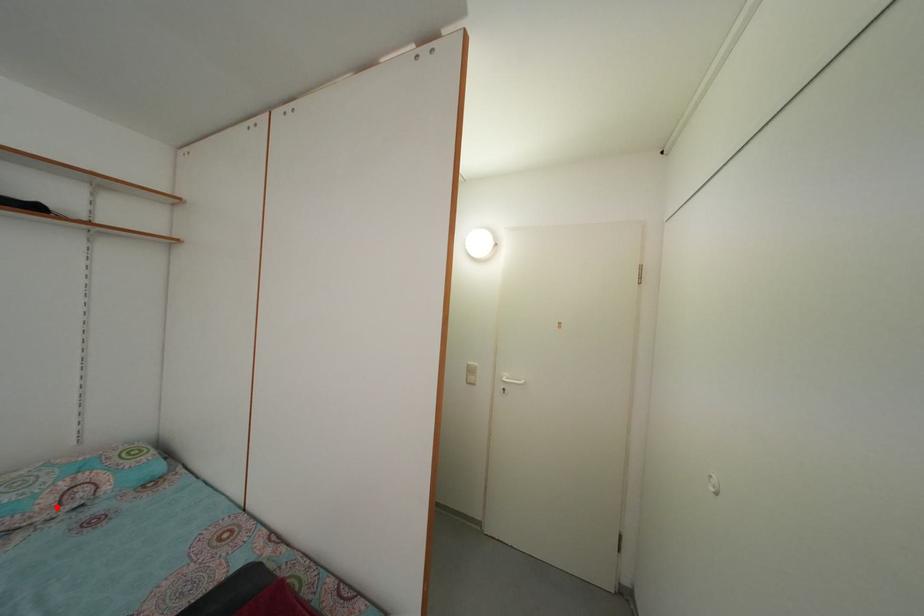
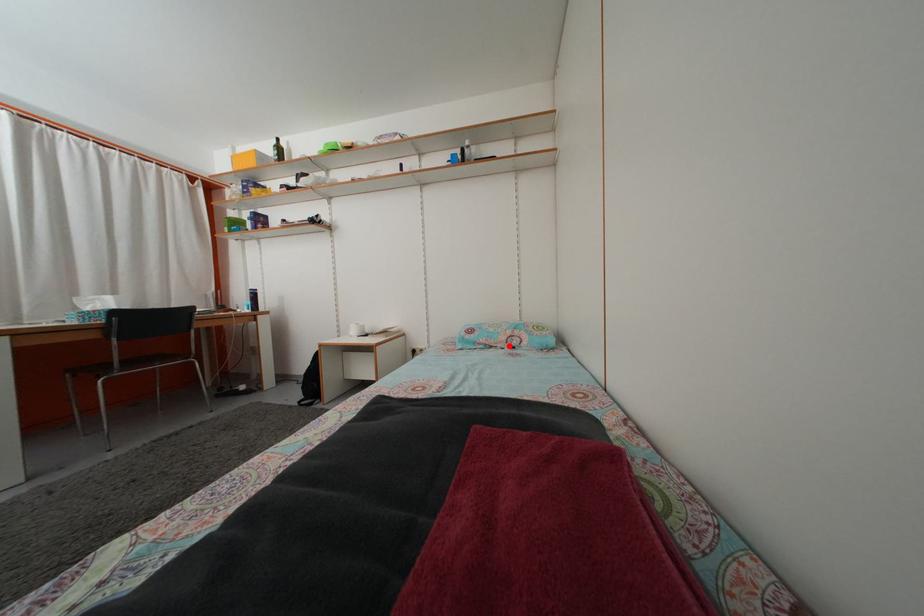
I am providing you with two images of the same scene from different viewpoints. A red point is marked on the first image and another point is marked on the second image. Is the marked point in image1 the same physical position as the marked point in image2?

Yes